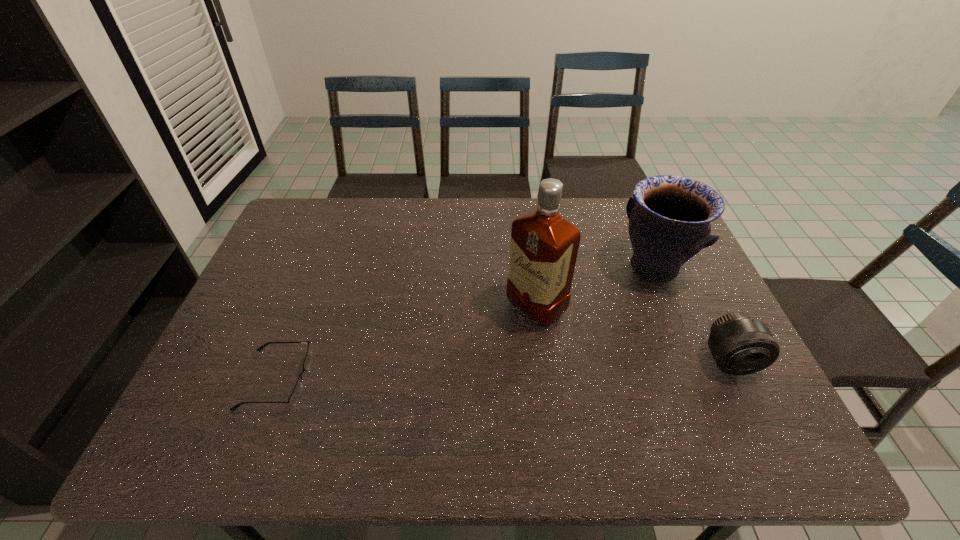
Where is `vacant space on the desktop that is between the spectacles and the third tallest object and is positioned on the front label of the liquor`? This screenshot has height=540, width=960. vacant space on the desktop that is between the spectacles and the third tallest object and is positioned on the front label of the liquor is located at coordinates (452, 372).

The height and width of the screenshot is (540, 960). Find the location of `free space on the desktop that is between the shortest object and the telephoto lens and is positioned on the front handle of the third shortest object`. free space on the desktop that is between the shortest object and the telephoto lens and is positioned on the front handle of the third shortest object is located at coordinates (522, 369).